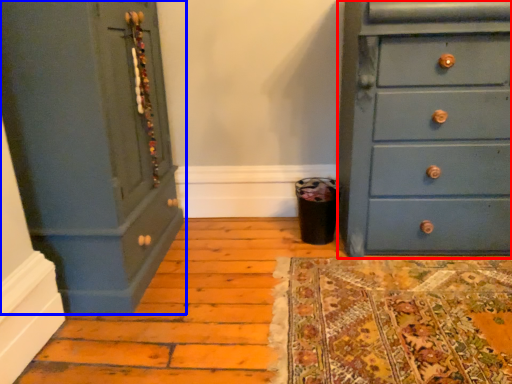
Question: Which point is further to the camera, chest of drawers (highlighted by a red box) or chest of drawers (highlighted by a blue box)?

Choices:
 (A) chest of drawers
 (B) chest of drawers

Answer: (A)